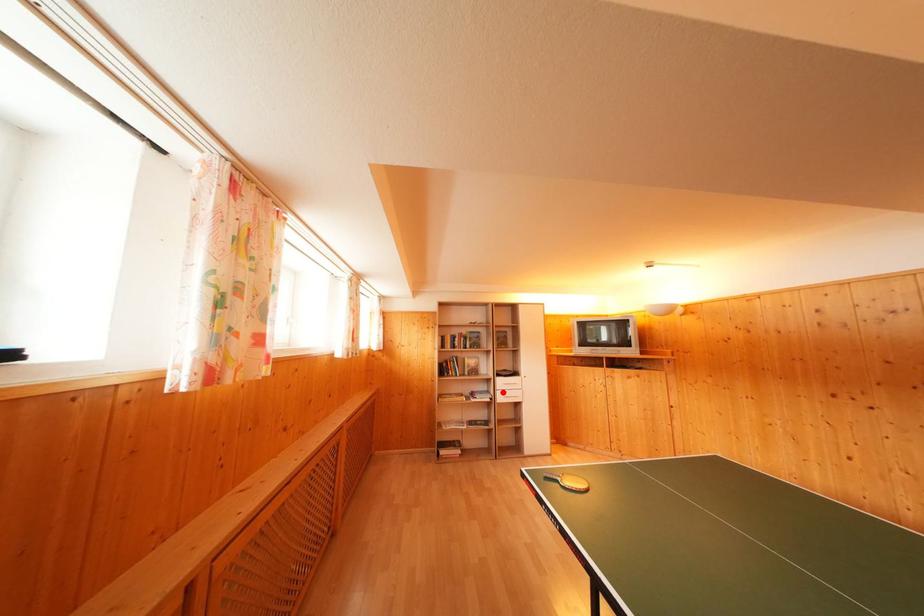
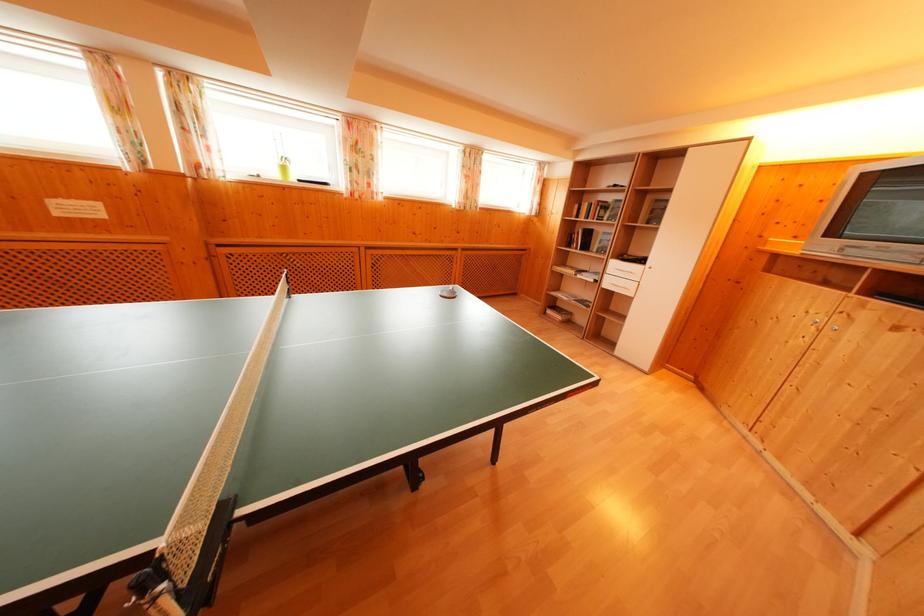
The point at the highlighted location is marked in the first image. Where is the corresponding point in the second image?

(614, 276)